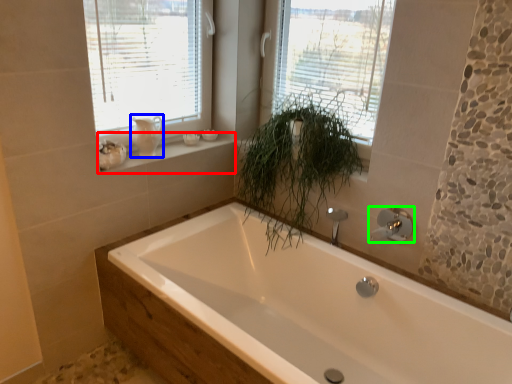
Question: Which object is the farthest from window sill (highlighted by a red box)? Choose among these: gray (highlighted by a blue box) or tap (highlighted by a green box).

Choices:
 (A) gray
 (B) tap

Answer: (B)